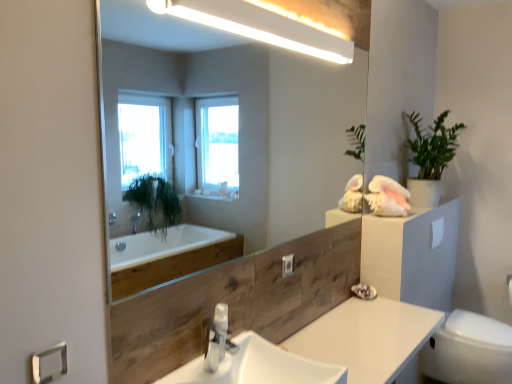
Question: Is white glossy light fixture at upper center wider than white glossy toilet bowl at lower right?

Choices:
 (A) no
 (B) yes

Answer: (A)

Question: Would you say white glossy light fixture at upper center contains white glossy toilet bowl at lower right?

Choices:
 (A) yes
 (B) no

Answer: (B)

Question: Is white glossy light fixture at upper center to the right of white glossy toilet bowl at lower right from the viewer's perspective?

Choices:
 (A) no
 (B) yes

Answer: (A)

Question: Could you tell me if white glossy light fixture at upper center is turned towards white glossy toilet bowl at lower right?

Choices:
 (A) no
 (B) yes

Answer: (A)

Question: Considering the relative sizes of white glossy light fixture at upper center and white glossy toilet bowl at lower right in the image provided, is white glossy light fixture at upper center smaller than white glossy toilet bowl at lower right?

Choices:
 (A) yes
 (B) no

Answer: (A)

Question: Choose the correct answer: Is white glossy light fixture at upper center inside green matte plant at upper right or outside it?

Choices:
 (A) outside
 (B) inside

Answer: (A)

Question: Is white glossy light fixture at upper center taller or shorter than green matte plant at upper right?

Choices:
 (A) short
 (B) tall

Answer: (A)

Question: Does point 176,1 appear closer or farther from the camera than point 449,155?

Choices:
 (A) farther
 (B) closer

Answer: (B)

Question: From the image's perspective, is white glossy light fixture at upper center above or below green matte plant at upper right?

Choices:
 (A) below
 (B) above

Answer: (B)

Question: Choose the correct answer: Is white matte toilet paper at right inside white glossy light fixture at upper center or outside it?

Choices:
 (A) inside
 (B) outside

Answer: (B)

Question: Considering the positions of white matte toilet paper at right and white glossy light fixture at upper center in the image, is white matte toilet paper at right wider or thinner than white glossy light fixture at upper center?

Choices:
 (A) thin
 (B) wide

Answer: (A)

Question: From a real-world perspective, relative to white glossy light fixture at upper center, is white matte toilet paper at right vertically above or below?

Choices:
 (A) below
 (B) above

Answer: (A)

Question: Is point (433, 243) positioned closer to the camera than point (285, 43)?

Choices:
 (A) closer
 (B) farther

Answer: (B)

Question: Does point tap(398, 304) appear closer or farther from the camera than point tap(435, 233)?

Choices:
 (A) farther
 (B) closer

Answer: (B)

Question: Considering the positions of white glossy countertop at center and white matte toilet paper at right in the image, is white glossy countertop at center taller or shorter than white matte toilet paper at right?

Choices:
 (A) short
 (B) tall

Answer: (B)